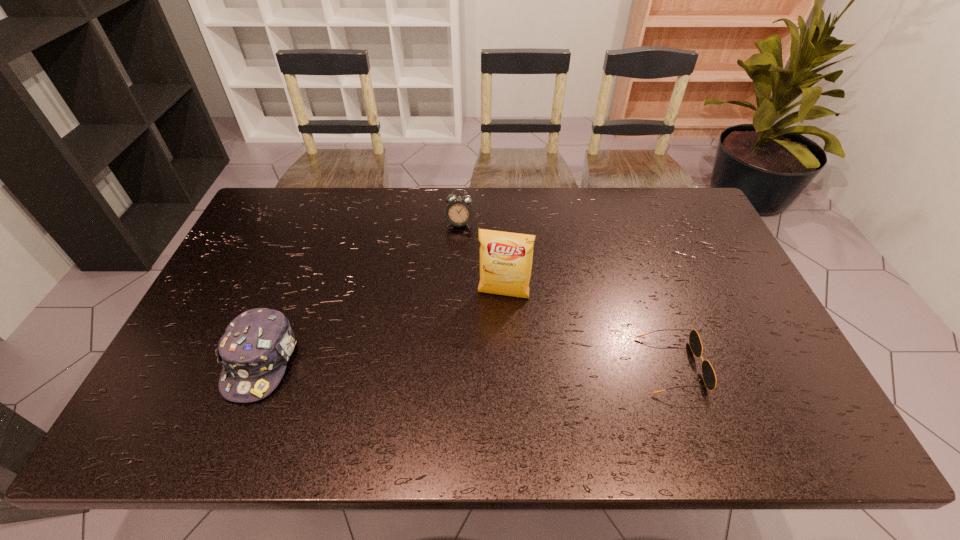
Locate which object is the closest to the third object from left to right. Please provide its 2D coordinates. Your answer should be formatted as a tuple, i.e. [(x, y)], where the tuple contains the x and y coordinates of a point satisfying the conditions above.

[(458, 212)]

Identify which object is the second nearest to the headwear. Please provide its 2D coordinates. Your answer should be formatted as a tuple, i.e. [(x, y)], where the tuple contains the x and y coordinates of a point satisfying the conditions above.

[(458, 212)]

You are a GUI agent. You are given a task and a screenshot of the screen. Output one action in this format:
    pyautogui.click(x=<x>, y=<y>)
    Task: Click on the free space in the image that satisfies the following two spatial constraints: 1. on the front side of the second object from left to right; 2. on the left side of the third nearest object
    
    Given the screenshot: What is the action you would take?
    pyautogui.click(x=456, y=295)

Locate an element on the screen. blank area in the image that satisfies the following two spatial constraints: 1. on the front-facing side of the leftmost object; 2. on the front-facing side of the shortest object is located at coordinates (260, 366).

I want to click on blank space that satisfies the following two spatial constraints: 1. on the front side of the second object from right to left; 2. on the front-facing side of the shortest object, so point(507,366).

Image resolution: width=960 pixels, height=540 pixels. Identify the location of free location that satisfies the following two spatial constraints: 1. on the front-facing side of the rightmost object; 2. on the front-facing side of the leftmost object. point(260,366).

Where is `free point that satisfies the following two spatial constraints: 1. on the front-facing side of the shortest object; 2. on the front-facing side of the headwear`? This screenshot has height=540, width=960. free point that satisfies the following two spatial constraints: 1. on the front-facing side of the shortest object; 2. on the front-facing side of the headwear is located at coordinates (260, 366).

Locate an element on the screen. vacant space that satisfies the following two spatial constraints: 1. on the front-facing side of the sunglasses; 2. on the front-facing side of the headwear is located at coordinates (260, 366).

The height and width of the screenshot is (540, 960). In order to click on vacant space that satisfies the following two spatial constraints: 1. on the front-facing side of the headwear; 2. on the front-facing side of the rightmost object in this screenshot , I will do `click(260, 366)`.

This screenshot has height=540, width=960. I want to click on vacant space that satisfies the following two spatial constraints: 1. on the front side of the sunglasses; 2. on the front-facing side of the third object from right to left, so click(x=452, y=366).